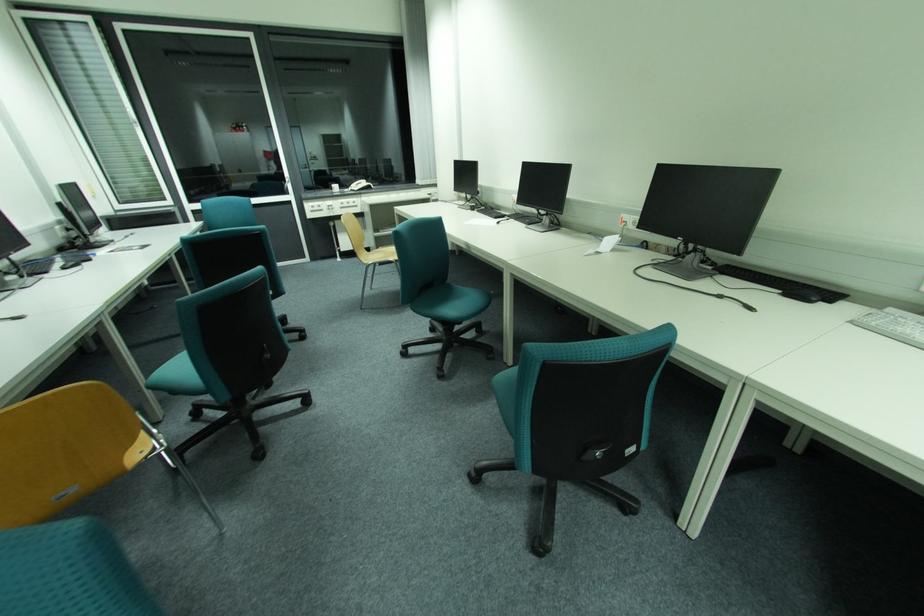
Locate an element on the screen. drawer pull hole is located at coordinates (643, 223).